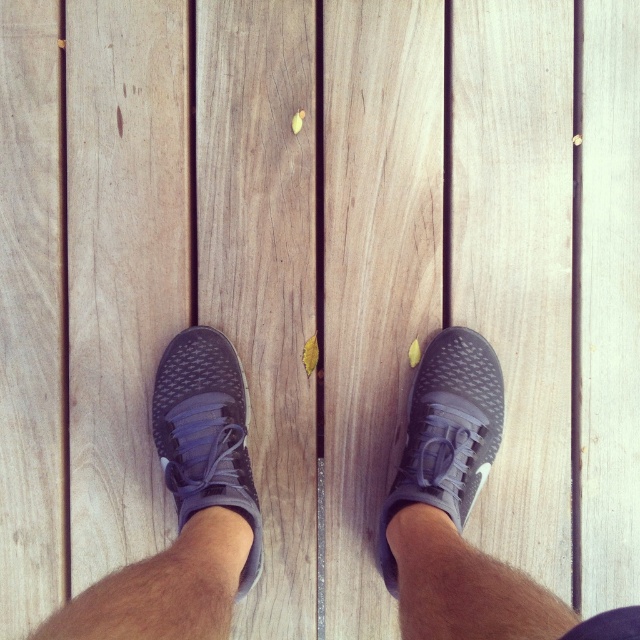
You are a photographer trying to capture the texture of the deck planks. You notice a point at coordinates (205, 433). What object is located at this point?

The point at coordinates (205, 433) indicates the matte gray shoe at center.

You are designing a custom shoe rack for the matte gray shoe at center and the matte gray shoe at lower right. Since both shoes are matte gray, how can you ensure they are placed correctly on the rack?

The matte gray shoe at center is smaller than the matte gray shoe at lower right, so you should place the smaller one in the designated spot for the center shoe and the larger one at the lower right position to match their sizes.